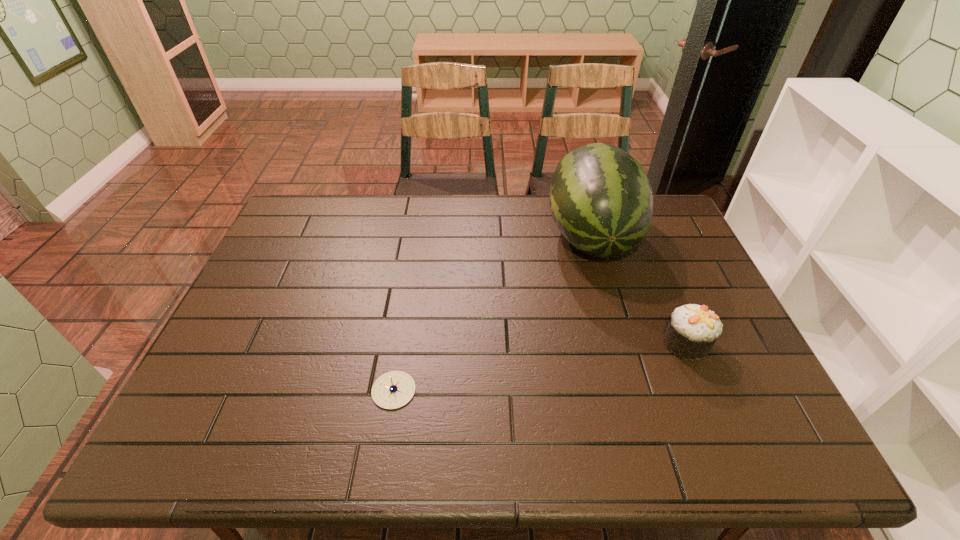
Locate an element on the screen. The image size is (960, 540). free space that satisfies the following two spatial constraints: 1. on the front side of the farthest object; 2. on the right side of the cupcake is located at coordinates (622, 344).